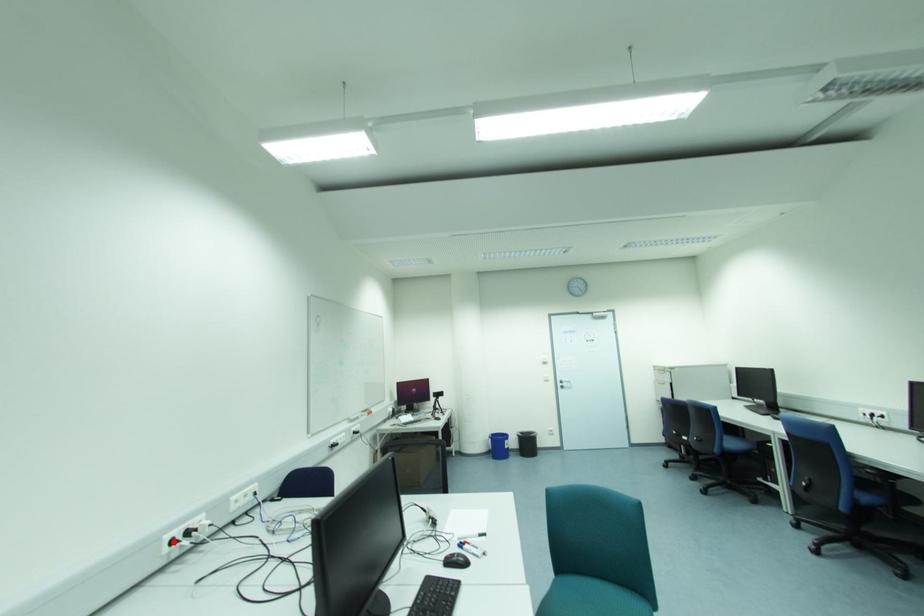
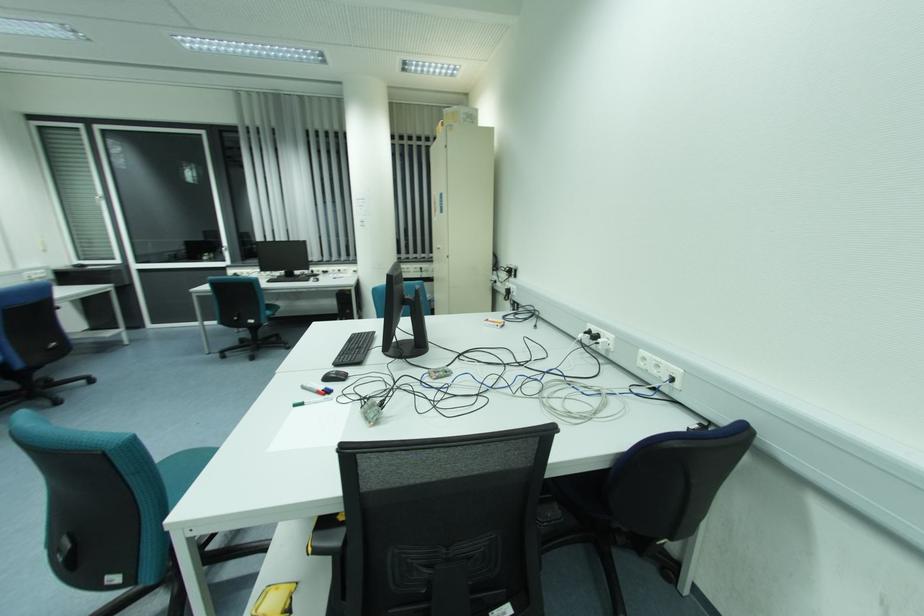
Locate, in the second image, the point that corresponds to the highlighted location in the first image.

(590, 333)